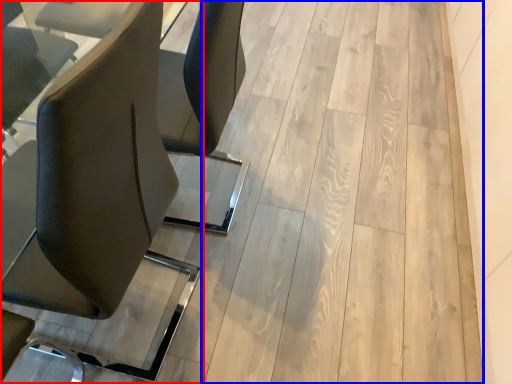
Question: Among these objects, which one is farthest to the camera, chair (highlighted by a red box) or plywood (highlighted by a blue box)?

Choices:
 (A) chair
 (B) plywood

Answer: (B)